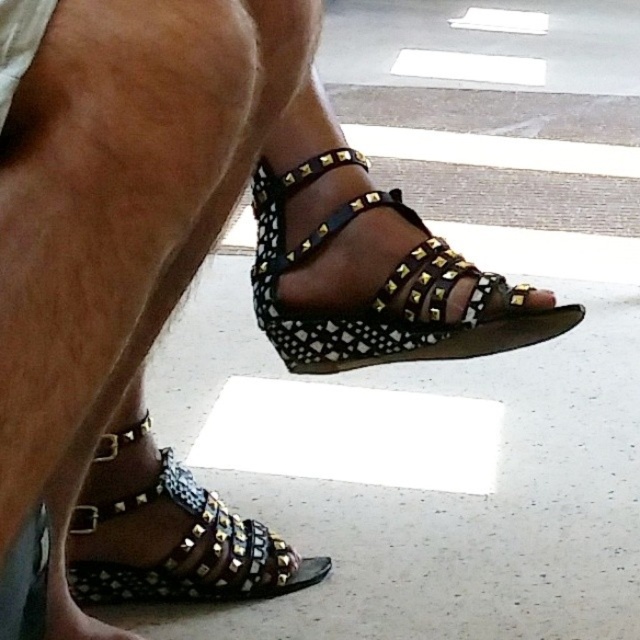
Is black studded sandal at lower left to the left of matte black sandal at center from the viewer's perspective?

Correct, you'll find black studded sandal at lower left to the left of matte black sandal at center.

Does black studded sandal at lower left have a smaller size compared to matte black sandal at center?

Actually, black studded sandal at lower left might be larger than matte black sandal at center.

What do you see at coordinates (173, 538) in the screenshot? Image resolution: width=640 pixels, height=640 pixels. I see `black studded sandal at lower left` at bounding box center [173, 538].

Find the location of `black studded sandal at lower left`. black studded sandal at lower left is located at coordinates (173, 538).

Who is lower down, black studded wedge at center or black studded sandal at lower left?

black studded sandal at lower left is below.

Is point (284, 358) positioned in front of point (154, 509)?

That is True.

Where is `black studded wedge at center`? The height and width of the screenshot is (640, 640). black studded wedge at center is located at coordinates (380, 289).

Is black studded wedge at center closer to camera compared to matte black sandal at center?

That is True.

Does black studded wedge at center have a greater width compared to matte black sandal at center?

Indeed, black studded wedge at center has a greater width compared to matte black sandal at center.

Between point (544, 324) and point (538, 305), which one is positioned behind?

The point (544, 324) is behind.

Where is `black studded wedge at center`? The width and height of the screenshot is (640, 640). black studded wedge at center is located at coordinates (380, 289).